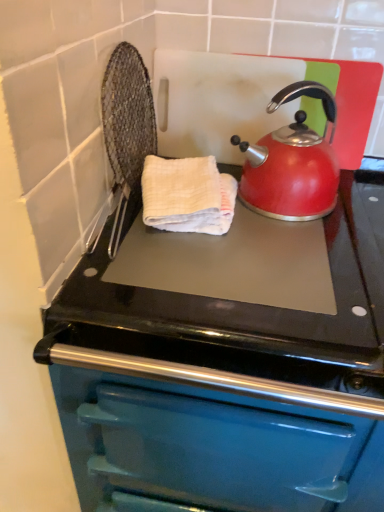
Where is `free space in front of shiny red kettle at upper right`? The image size is (384, 512). free space in front of shiny red kettle at upper right is located at coordinates (290, 256).